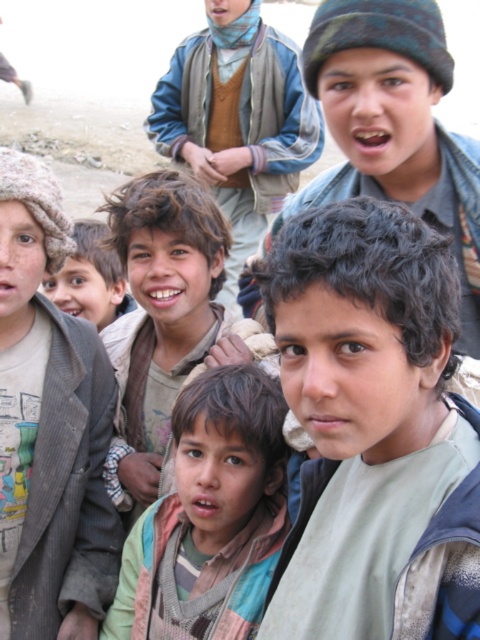
Between multicolored fabric shirt at center and brown woolen scarf at center, which one appears on the right side from the viewer's perspective?

brown woolen scarf at center is more to the right.

Between point (127, 627) and point (228, 19), which one is positioned in front?

Positioned in front is point (127, 627).

Based on the photo, measure the distance between point (272,458) and camera.

4.35 meters

Image resolution: width=480 pixels, height=640 pixels. In order to click on multicolored fabric shirt at center in this screenshot , I will do `click(210, 516)`.

Between point (357, 284) and point (301, 193), which one is positioned behind?

The point (301, 193) is more distant.

Is point (288, 314) positioned after point (361, 76)?

No, (288, 314) is in front of (361, 76).

I want to click on light brown fabric shirt at center, so click(x=373, y=429).

Is light brown woolen hat at left smaller than brown woolen scarf at center?

Yes, light brown woolen hat at left is smaller than brown woolen scarf at center.

Is point (67, 452) positioned after point (159, 150)?

No, (67, 452) is in front of (159, 150).

Which is in front, point (81, 547) or point (146, 122)?

Positioned in front is point (81, 547).

Locate an element on the screen. The height and width of the screenshot is (640, 480). light brown woolen hat at left is located at coordinates (48, 428).